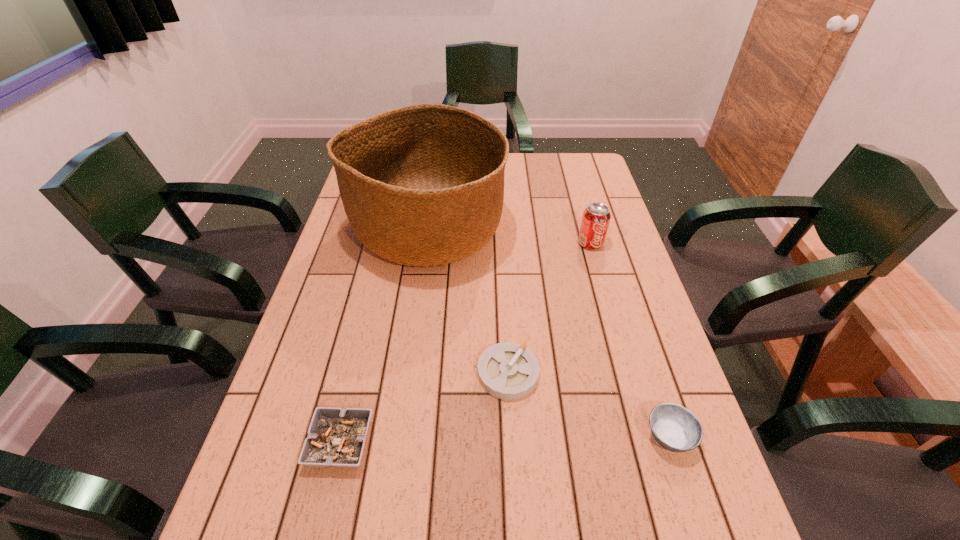
I want to click on free space between the fourth shortest object and the third farthest object, so click(549, 308).

Locate an element on the screen. vacant area that lies between the leftmost ashtray and the fourth shortest object is located at coordinates click(466, 343).

This screenshot has height=540, width=960. Find the location of `free area in between the rightmost ashtray and the soda can`. free area in between the rightmost ashtray and the soda can is located at coordinates (630, 340).

Find the location of a particular element. This screenshot has width=960, height=540. vacant region between the basket and the soda can is located at coordinates (510, 237).

At what (x,y) coordinates should I click in order to perform the action: click on vacant area between the leftmost ashtray and the fourth shortest object. Please return your answer as a coordinate pair (x, y). This screenshot has width=960, height=540. Looking at the image, I should click on (466, 343).

I want to click on unoccupied area between the leftmost ashtray and the basket, so click(384, 336).

This screenshot has height=540, width=960. Find the location of `free space between the leftmost ashtray and the basket`. free space between the leftmost ashtray and the basket is located at coordinates (384, 336).

Find the location of a particular element. The height and width of the screenshot is (540, 960). unoccupied area between the third tallest object and the leftmost ashtray is located at coordinates (505, 440).

This screenshot has width=960, height=540. I want to click on vacant area that lies between the leftmost ashtray and the tallest object, so click(384, 336).

Find the location of a particular element. The height and width of the screenshot is (540, 960). free space between the basket and the leftmost ashtray is located at coordinates click(384, 336).